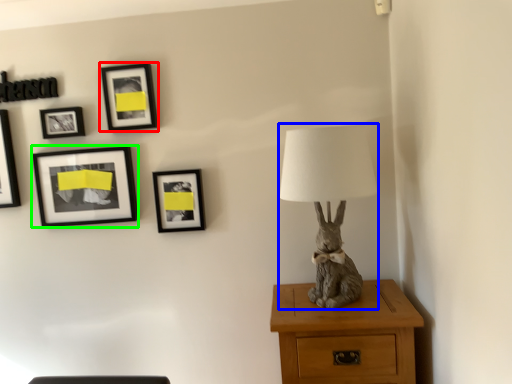
Question: Considering the real-world distances, which object is closest to picture frame (highlighted by a red box)? table lamp (highlighted by a blue box) or picture frame (highlighted by a green box).

Choices:
 (A) table lamp
 (B) picture frame

Answer: (B)